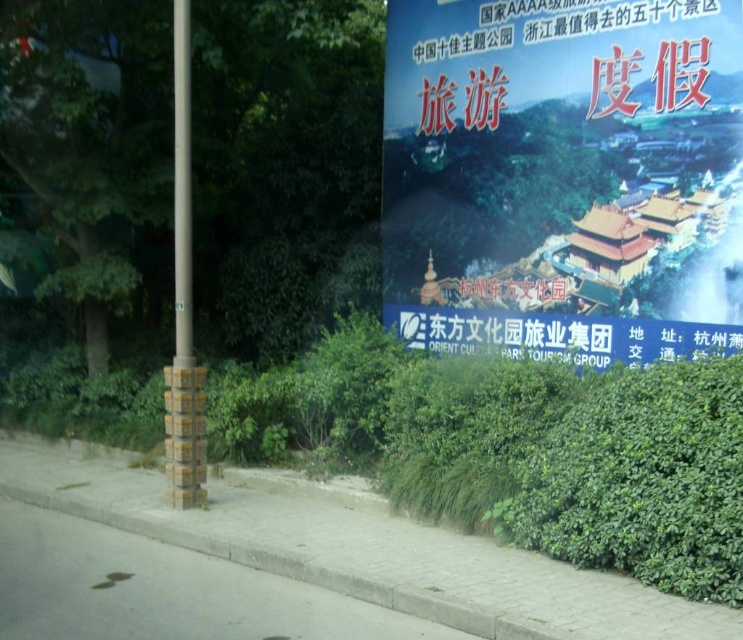
Question: Observing the image, what is the correct spatial positioning of blue glossy poster at upper right in reference to yellow painted metal pole at left?

Choices:
 (A) right
 (B) left

Answer: (A)

Question: Does gray concrete pavement at lower center lie behind yellow painted metal pole at left?

Choices:
 (A) yes
 (B) no

Answer: (B)

Question: Which is farther from the white paper at center?

Choices:
 (A) yellow painted metal pole at left
 (B) gray concrete pavement at lower center

Answer: (B)

Question: Which point is closer to the camera?

Choices:
 (A) gray concrete pavement at lower center
 (B) blue glossy poster at upper right
 (C) white paper at center

Answer: (A)

Question: Which of the following is the farthest from the observer?

Choices:
 (A) blue glossy poster at upper right
 (B) white paper at center
 (C) yellow painted metal pole at left
 (D) gray concrete pavement at lower center

Answer: (C)

Question: Can you confirm if gray concrete pavement at lower center is bigger than white paper at center?

Choices:
 (A) no
 (B) yes

Answer: (A)